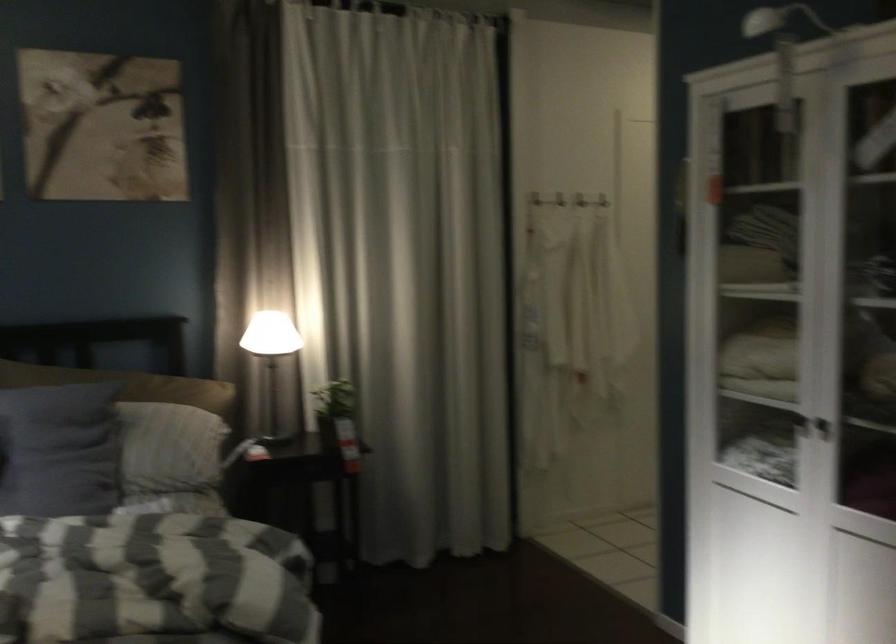
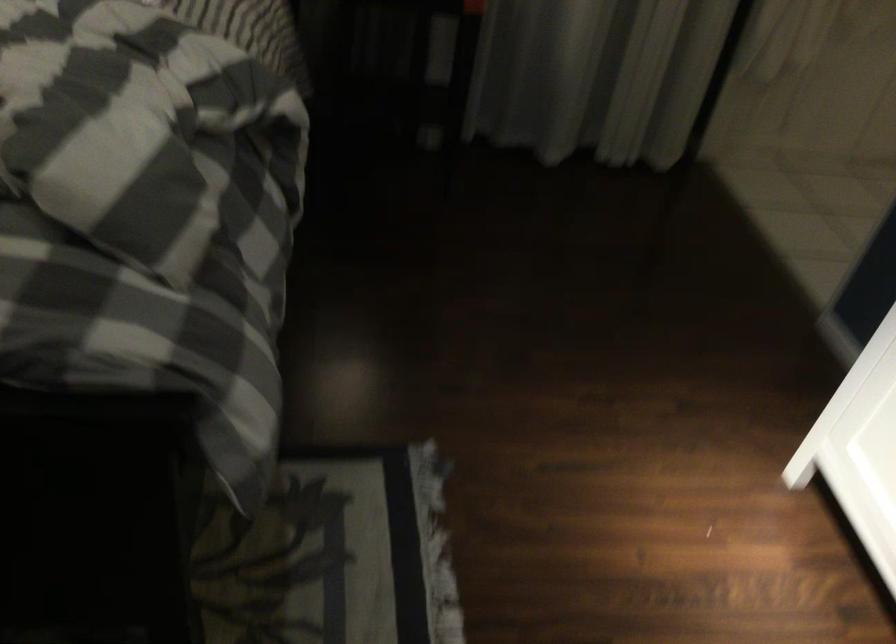
Question: How did the camera likely rotate?

Choices:
 (A) Left
 (B) Right
 (C) Up
 (D) Down

Answer: (D)